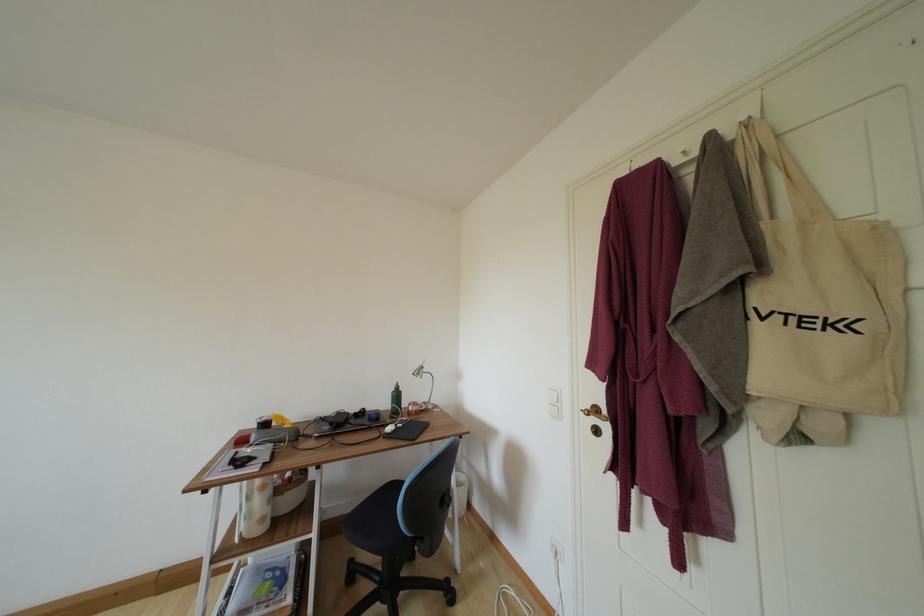
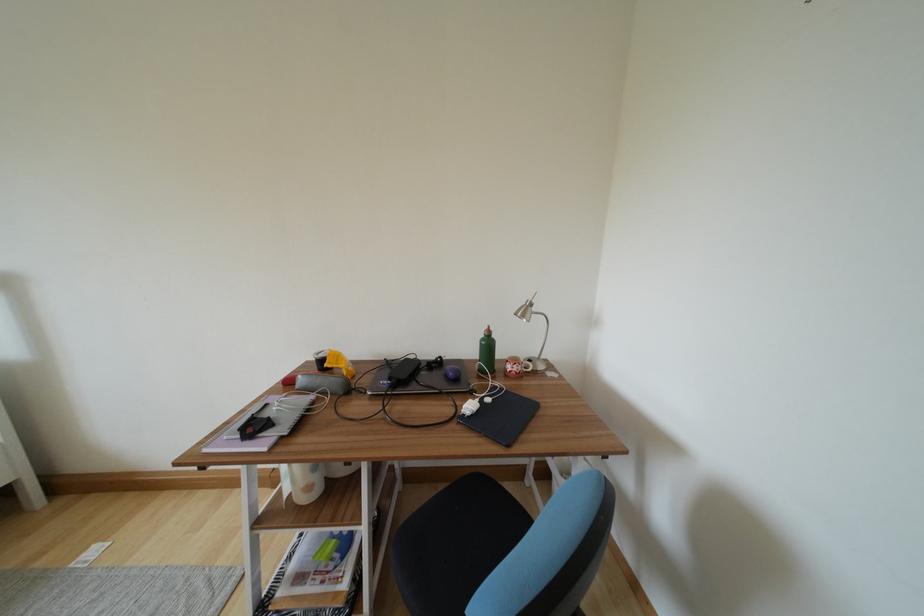
In the second image, find the point that corresponds to [402,400] in the first image.

(493, 349)